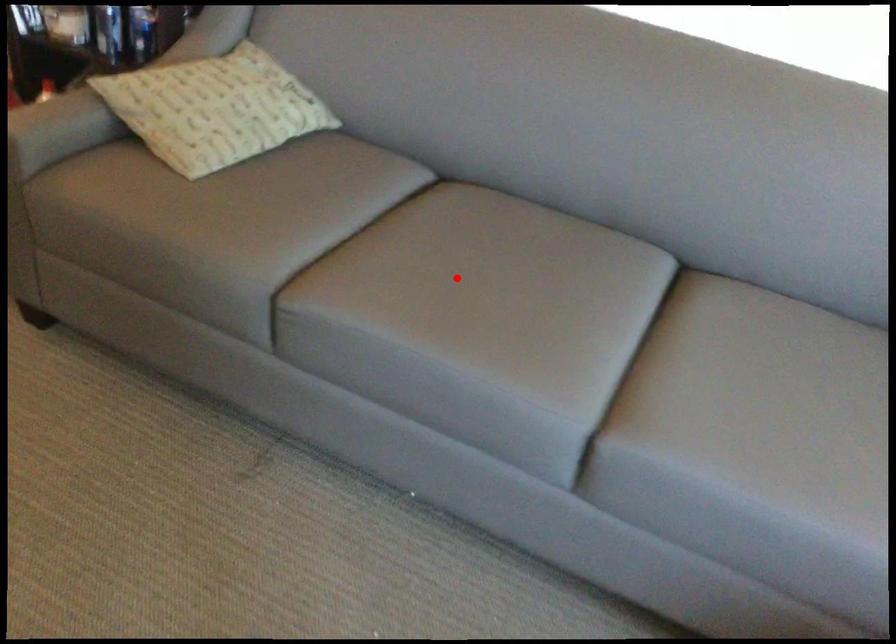
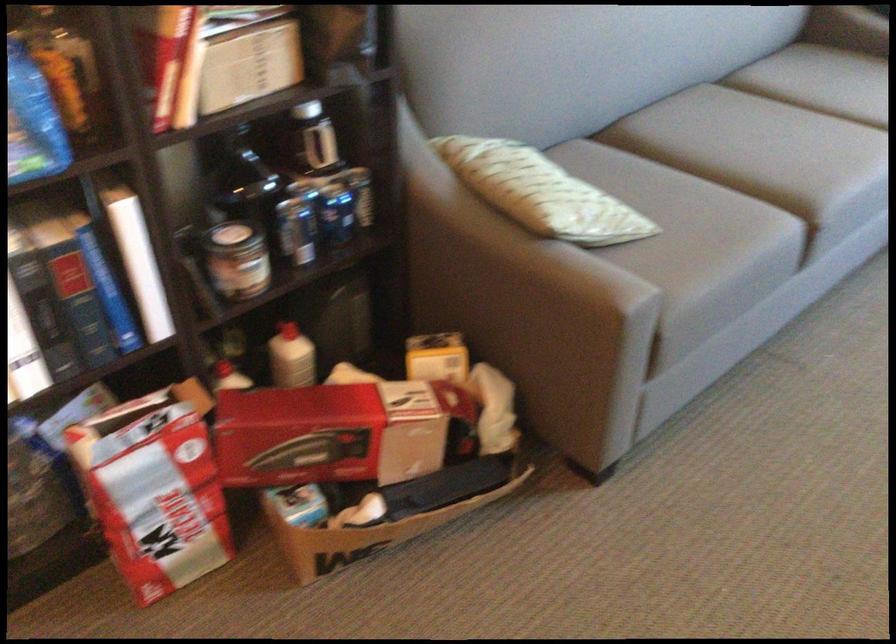
Question: I am providing you with two images of the same scene from different viewpoints. In image1, a red point is highlighted. Considering the same 3D point in image2, which of the following is correct?

Choices:
 (A) It is closer
 (B) It is farther

Answer: (B)